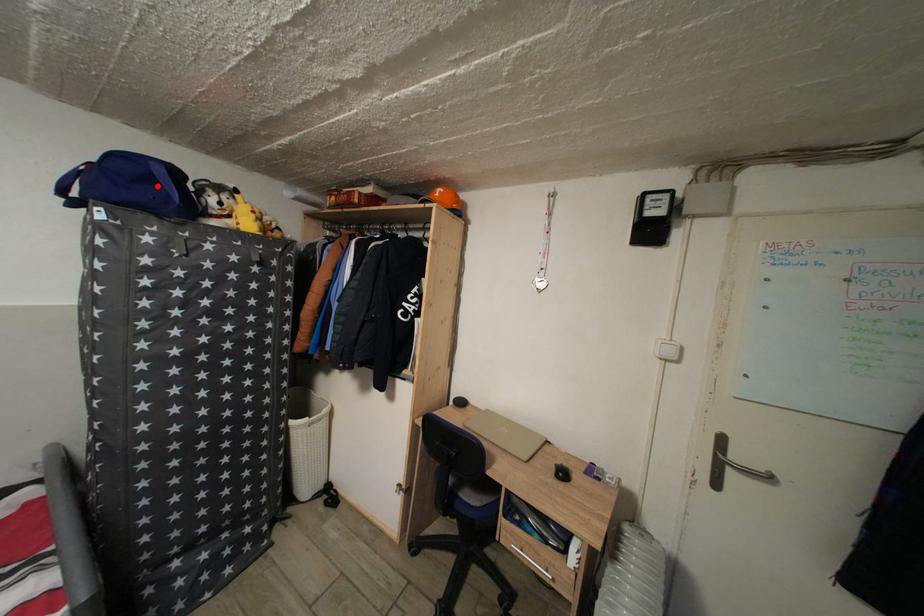
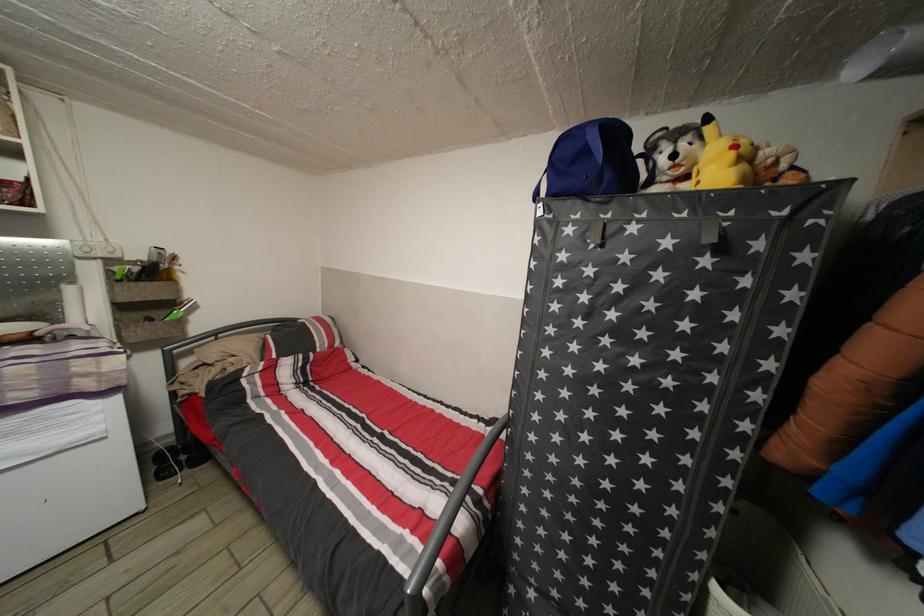
Locate, in the second image, the point that corresponds to the highlighted location in the first image.

(591, 158)